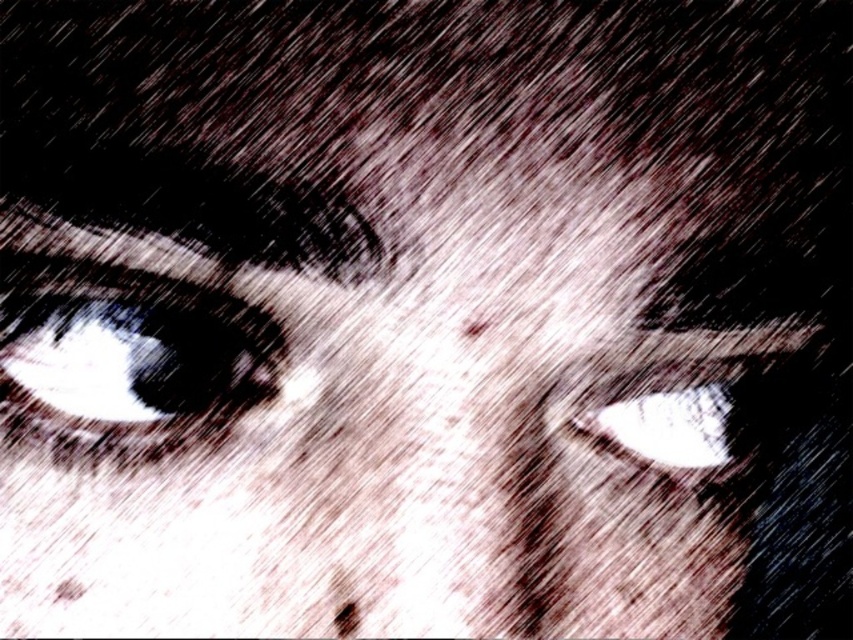
You are an artist analyzing the image. You notice two eyes in the scene. Which eye is taller between the shiny black eye at left and the white glossy eye at center?

The shiny black eye at left is taller than the white glossy eye at center.

In the image, there are two eyes visible. The shiny black eye at left and the white glossy eye at center. Which one is positioned more to the left side of the image?

The shiny black eye at left is positioned more to the left side of the image than the white glossy eye at center.